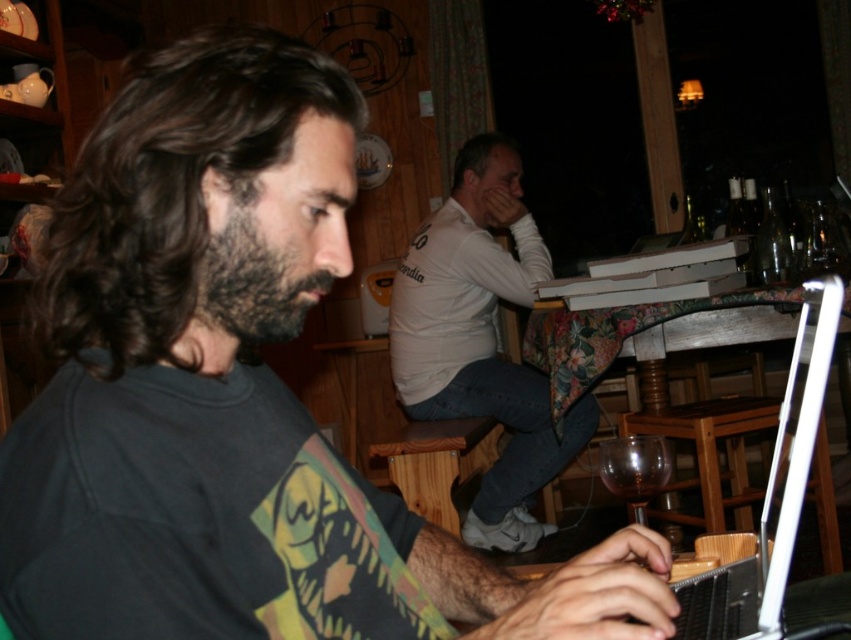
Which is below, white plastic laptop at lower right or dark brown fuzzy beard at left?

white plastic laptop at lower right is below.

Between white plastic laptop at lower right and dark brown fuzzy beard at left, which one has less height?

Standing shorter between the two is dark brown fuzzy beard at left.

The height and width of the screenshot is (640, 851). I want to click on white plastic laptop at lower right, so click(x=774, y=497).

Is white cotton shirt at upper center positioned behind dark brown hair at upper center?

That is False.

Identify the location of white cotton shirt at upper center. (481, 348).

Is dark brown wavy hair at left below white plastic laptop at lower right?

Actually, dark brown wavy hair at left is above white plastic laptop at lower right.

Is the position of dark brown wavy hair at left less distant than that of white plastic laptop at lower right?

Yes, it is.

Who is more distant from viewer, (201,173) or (780,403)?

The point (780,403) is more distant.

You are a GUI agent. You are given a task and a screenshot of the screen. Output one action in this format:
    pyautogui.click(x=<x>, y=<y>)
    Task: Click on the dark brown wavy hair at left
    The height and width of the screenshot is (640, 851).
    Given the screenshot: What is the action you would take?
    pyautogui.click(x=170, y=182)